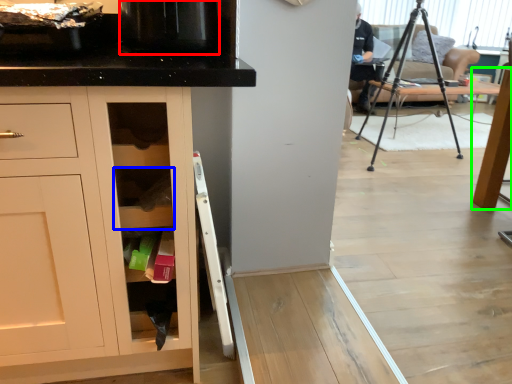
Question: Based on their relative distances, which object is farther from appliance (highlighted by a red box)? Choose from shelf (highlighted by a blue box) and table (highlighted by a green box).

Choices:
 (A) shelf
 (B) table

Answer: (B)